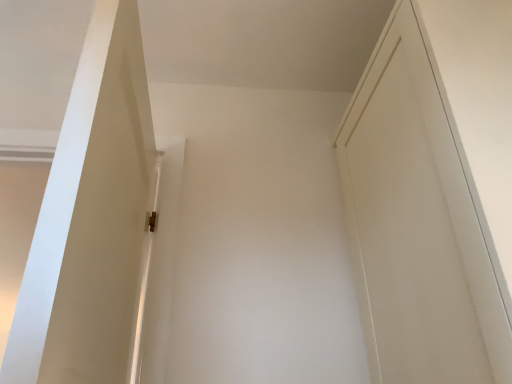
The width and height of the screenshot is (512, 384). What are the coordinates of `white matte door at center` in the screenshot? It's located at (90, 218).

What do you see at coordinates (90, 218) in the screenshot?
I see `white matte door at center` at bounding box center [90, 218].

Measure the distance between point (117,376) and camera.

The distance of point (117,376) from camera is 36.14 inches.

The image size is (512, 384). Find the location of `white matte door at center`. white matte door at center is located at coordinates (x=90, y=218).